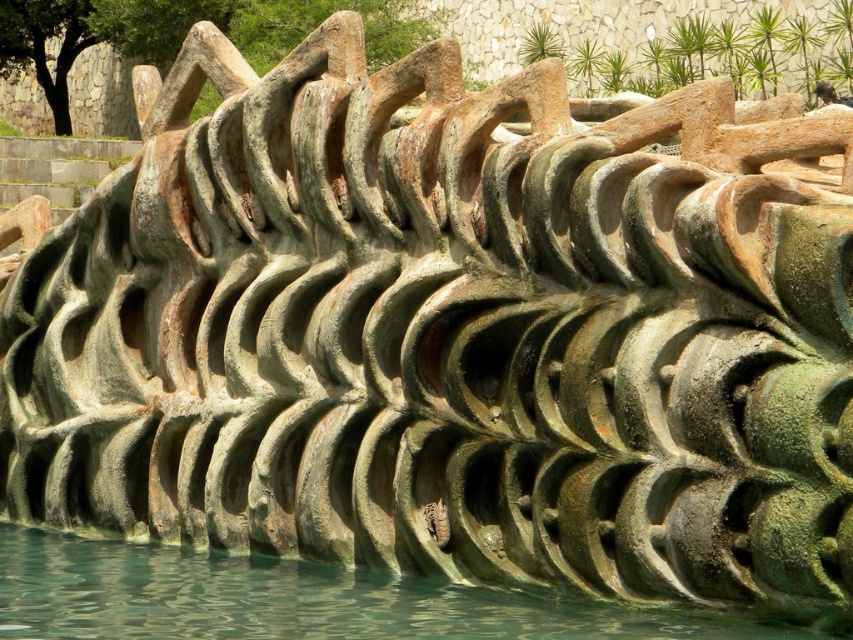
Based on the photo, you are standing in front of the sculptural structure and notice the greenish water at bottom and the shiny metallic snake at center. Which object is positioned lower in the scene?

The greenish water at bottom is positioned lower than the shiny metallic snake at center.

You are standing in front of the sculptural structure and want to place a small decorative item between the greenish water at bottom and the shiny metallic snake at center. Considering their widths, which object should you place the item closer to to ensure it fits better?

The greenish water at bottom is wider than the shiny metallic snake at center. Therefore, placing the item closer to the greenish water at bottom would provide more space for it to fit better.